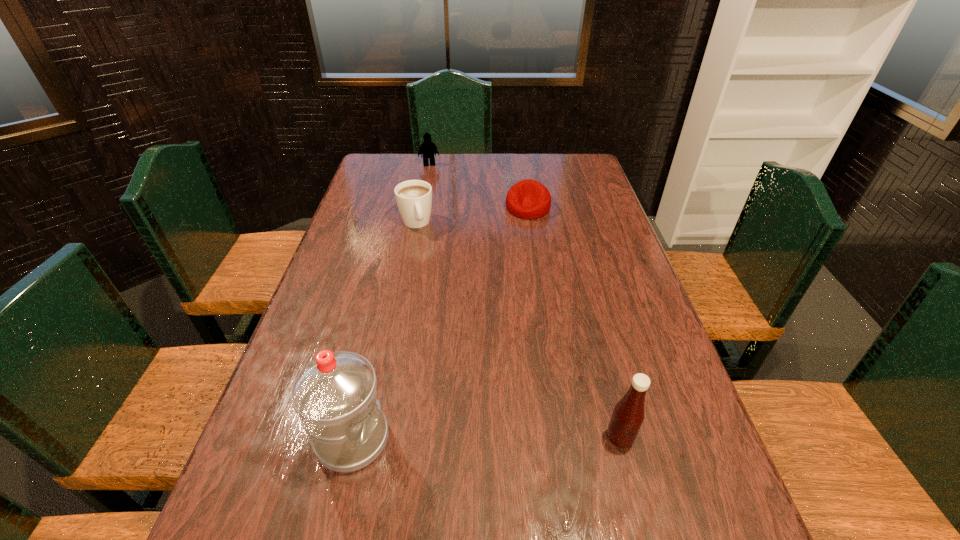
Image resolution: width=960 pixels, height=540 pixels. What are the coordinates of `free region that satisfies the following two spatial constraints: 1. on the front side of the Tabasco sauce; 2. on the right side of the cappuccino` in the screenshot? It's located at (374, 438).